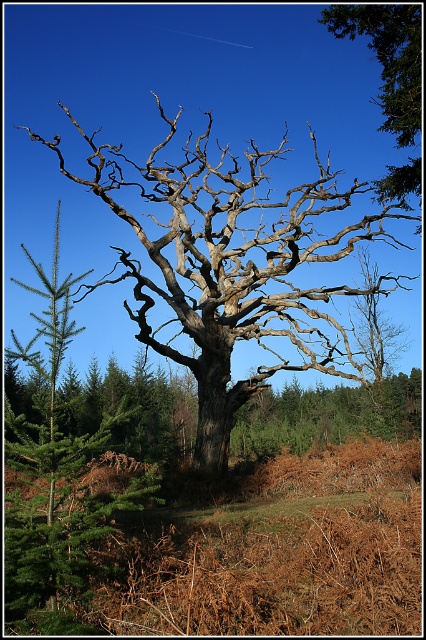
Question: Does dead wood tree at center appear on the right side of brown textured bark at upper right?

Choices:
 (A) no
 (B) yes

Answer: (A)

Question: Is dead wood tree at center positioned at the back of brown textured bark at upper right?

Choices:
 (A) yes
 (B) no

Answer: (B)

Question: Which of the following is the closest to the observer?

Choices:
 (A) brown textured bark at upper right
 (B) dead wood tree at center

Answer: (B)

Question: Does dead wood tree at center lie behind brown textured bark at upper right?

Choices:
 (A) yes
 (B) no

Answer: (B)

Question: Among these objects, which one is nearest to the camera?

Choices:
 (A) brown textured bark at upper right
 (B) dead wood tree at center

Answer: (B)